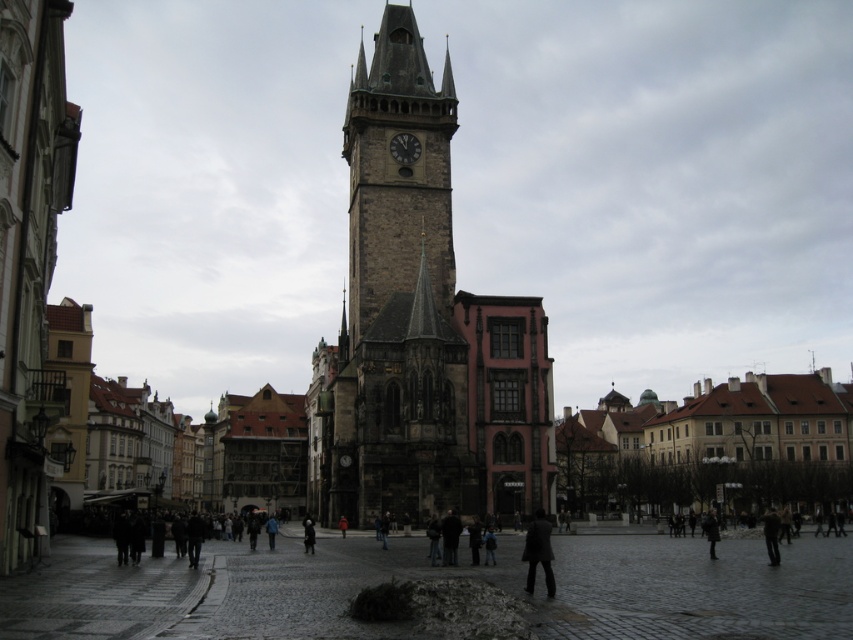
You are standing in the square and want to place a 40 meter long banner between the dark gray coat at lower right and the dark gray stone clock at center. Will the banner be long enough to stretch between them?

The dark gray coat at lower right and dark gray stone clock at center are 42.62 meters apart. The banner is only 40 meters long, so it will not be long enough to stretch between them.

You are a tourist standing in the square and want to take a photo of the stone clock tower at center and the dark gray coat at lower right. If you want to include both in the frame, which object should you focus on to ensure both are visible?

The stone clock tower at center is wider than the dark gray coat at lower right. To include both in the frame, focus on the stone clock tower at center since it is wider and will require a wider angle to capture both objects.

You are a tour guide leading a group in the square. You want to ensure everyone can see both the stone clock tower at center and the dark gray stone clock at center clearly. Given that the average human viewing distance for clear visibility is 10 meters, can the group stay in their current position and still see both objects without moving closer?

The distance between the stone clock tower at center and the dark gray stone clock at center is 8.80 meters. Since the average viewing distance required is 10 meters, the group can remain in their current position as the distance between the two objects is within the acceptable range for clear visibility.